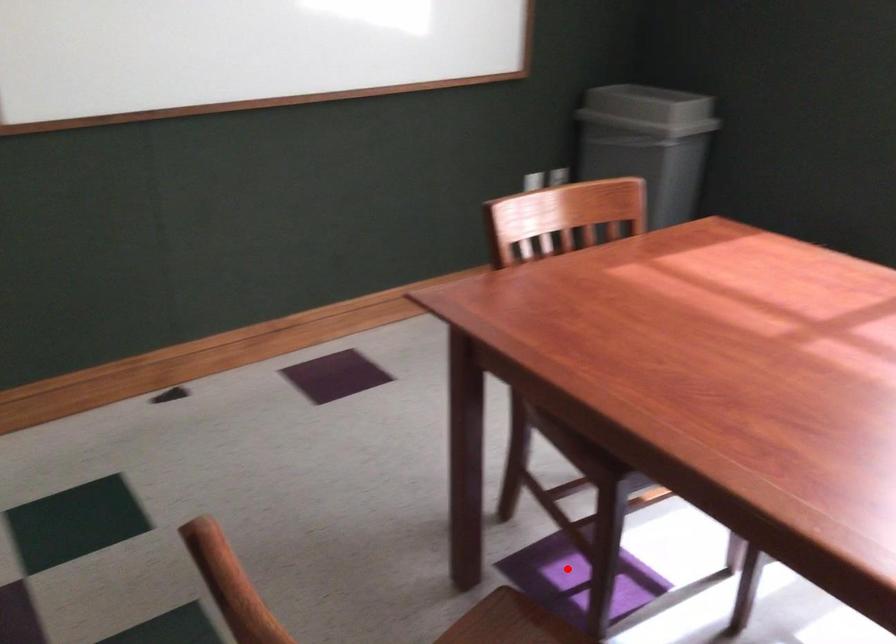
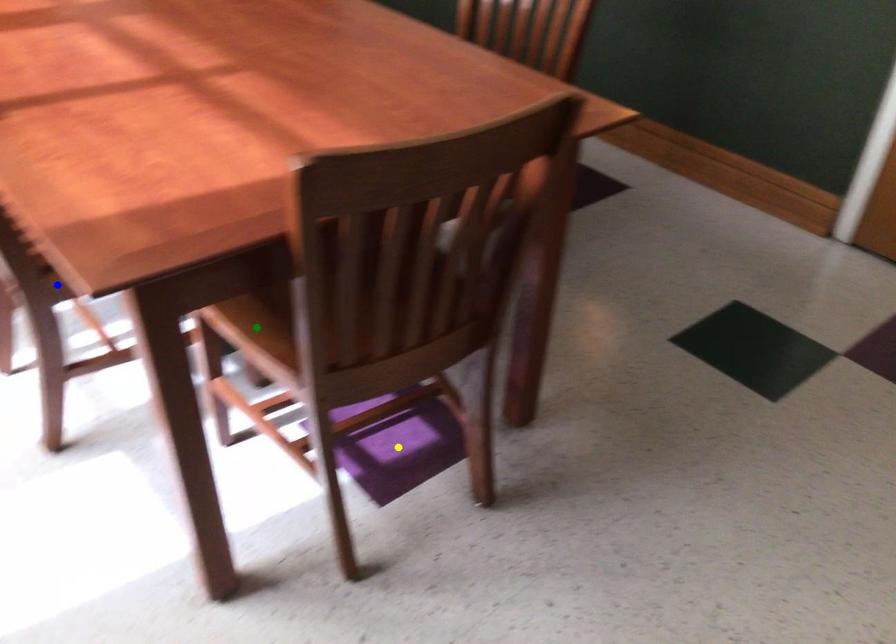
Question: I am providing you with two images of the same scene from different viewpoints. A red point is marked on the first image. You are given multiple points on the second image. Which point in image 2 is actually the same real-world point as the red point in image 1?

Choices:
 (A) blue point
 (B) green point
 (C) yellow point

Answer: (C)